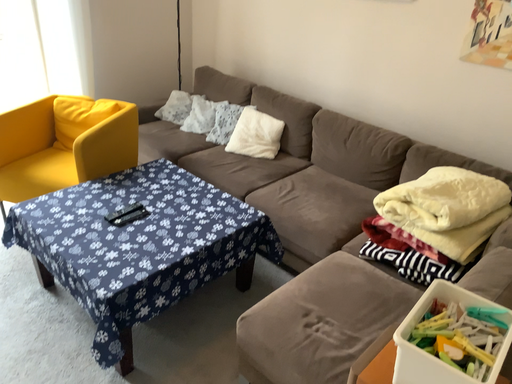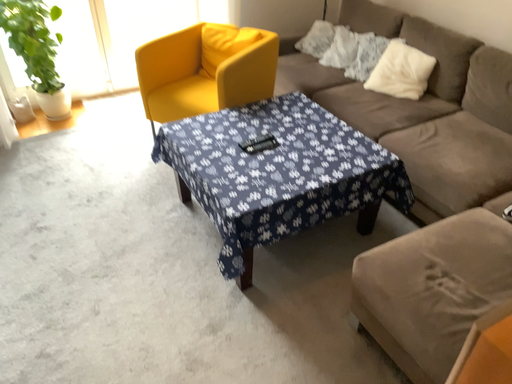
Question: How did the camera likely rotate when shooting the video?

Choices:
 (A) rotated upward
 (B) rotated downward

Answer: (B)